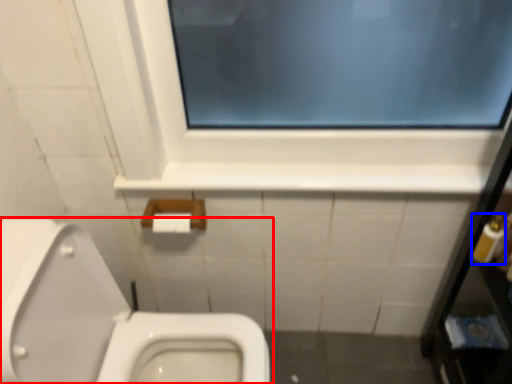
Question: Which object is further to the camera taking this photo, toilet (highlighted by a red box) or toiletry (highlighted by a blue box)?

Choices:
 (A) toilet
 (B) toiletry

Answer: (B)